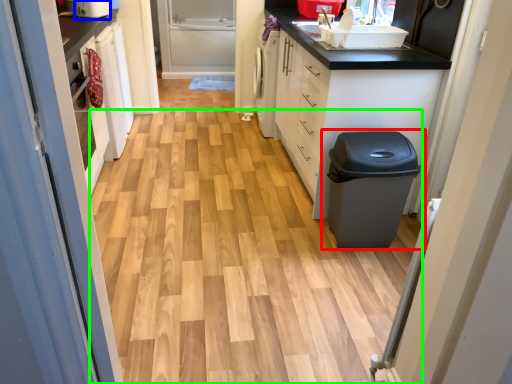
Question: Which object is positioned closest to waste container (highlighted by a red box)? Select from appliance (highlighted by a blue box) and plain (highlighted by a green box).

Choices:
 (A) appliance
 (B) plain

Answer: (B)